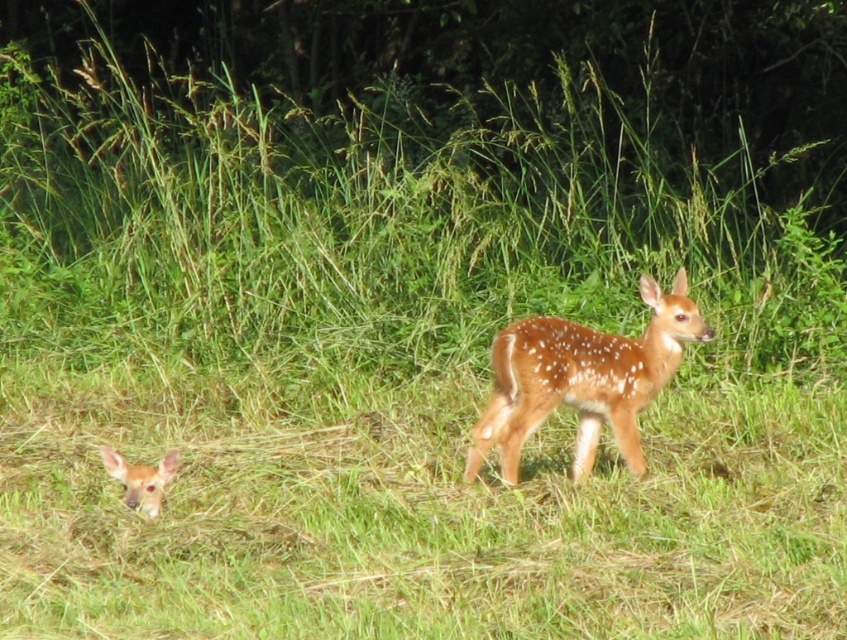
Looking at this image, is spotted fur deer at center above spotted fur deer at lower left?

Indeed, spotted fur deer at center is positioned over spotted fur deer at lower left.

Who is higher up, spotted fur deer at center or spotted fur deer at lower left?

spotted fur deer at center

Which is behind, point (623, 406) or point (169, 474)?

The point (623, 406) is behind.

Where is `spotted fur deer at center`? spotted fur deer at center is located at coordinates (582, 380).